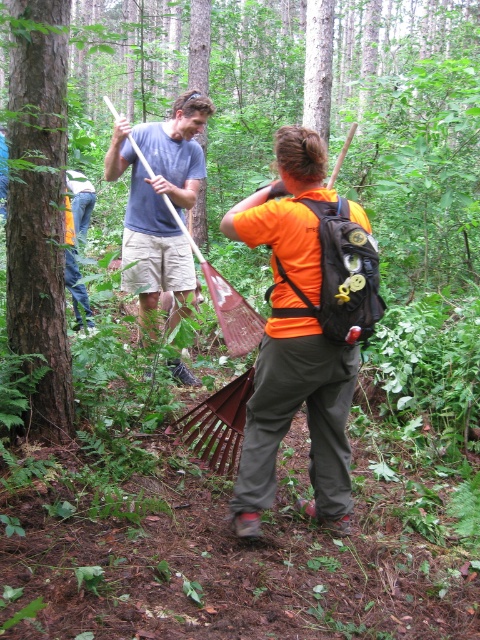
You are a hiker who wants to place a small backpack between the metallic rake at center and the matte blue shirt at upper center. Since the backpack is 15 inches wide, can it fit between them?

The metallic rake at center is wider than the matte blue shirt at upper center. Since the backpack is 15 inches wide, it can fit between them as long as the space between the two objects is at least 15 inches wide.

Based on the scene description, which tree trunk is positioned lower in the image, the brown rough tree trunk at center or the smooth brown tree trunk at center?

The brown rough tree trunk at center is positioned lower than the smooth brown tree trunk at center according to the description.